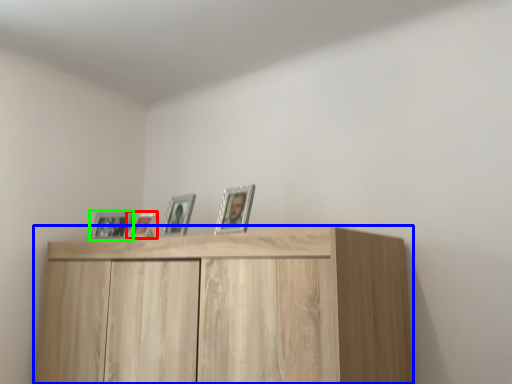
Question: Based on their relative distances, which object is farther from picture frame (highlighted by a red box)? Choose from cupboard (highlighted by a blue box) and picture frame (highlighted by a green box).

Choices:
 (A) cupboard
 (B) picture frame

Answer: (A)